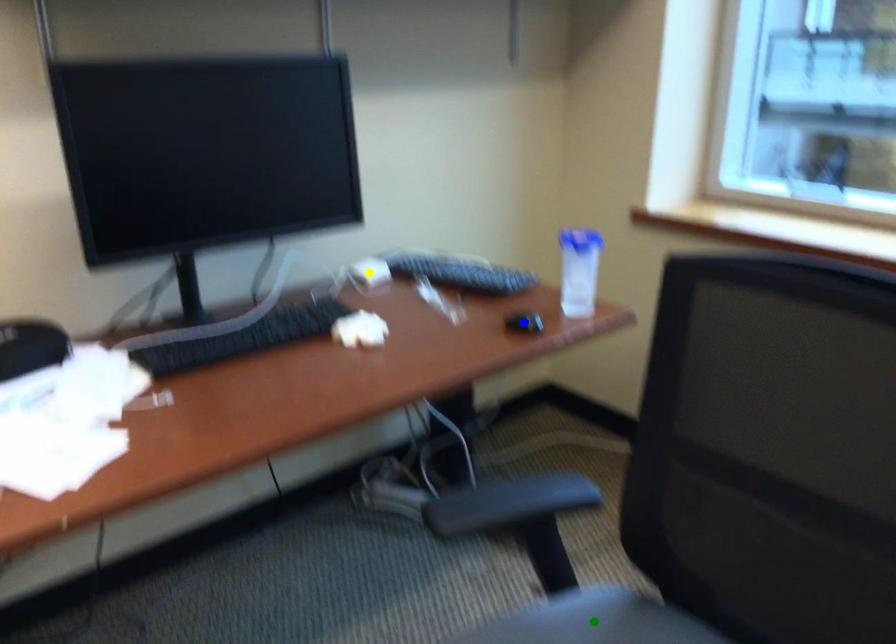
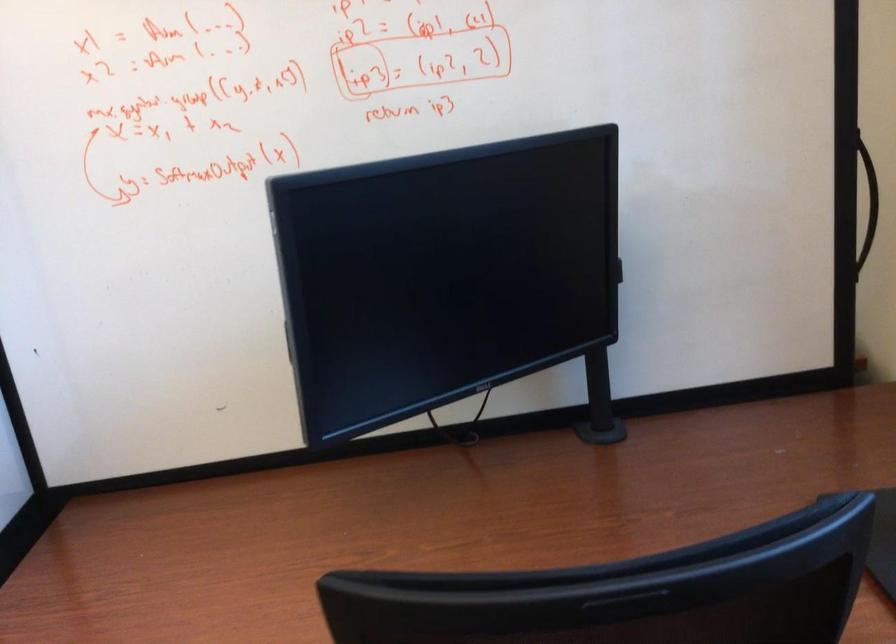
I am providing you with two images of the same scene from different viewpoints. Three points are marked in image1. Which point corresponds to a part or object that is occluded in image2?In image1, three points are marked. Which of them correspond to a part or object that is occluded in image2?Among the three points shown in image1, which one corresponds to a part or object that is no longer visible due to occlusion in image2?

blue point, yellow point, green point